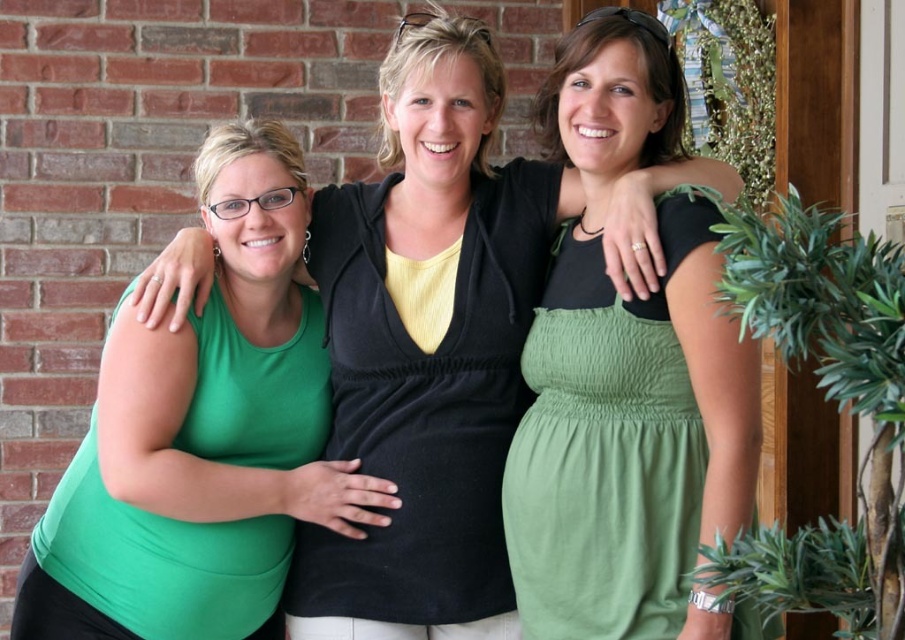
You are a photographer standing 10 feet away from the three women. You want to take a closeup shot of the matte black top at center and the green matte dress at left. Can you focus on both objects clearly in the same photo without moving your camera?

The matte black top at center is 14.09 inches away from the green matte dress at left. Since the distance between them is relatively small, you can focus on both objects clearly in the same photo without moving your camera.

You are a photographer setting up for a group photo. You have a camera with a lens that can focus on objects within a 2 inch range. You need to ensure that both the matte black top at center and the matte black dress at center are in focus. Based on their current positions, will both items be in focus?

The distance between the matte black top at center and the matte black dress at center is 1.97 inches, which is within the 2 inch range of the camera lens. Therefore, both items will be in focus.

You are a photographer trying to capture a photo of the two women in the center of the image. You want to ensure that both the matte black top at center and the green cotton dress at center are clearly visible in the frame. Based on their positions, which one should you focus on first to ensure proper exposure?

The matte black top at center is above the green cotton dress at center, so focusing on the matte black top at center first will ensure proper exposure since it is positioned higher and might be in a different lighting area.